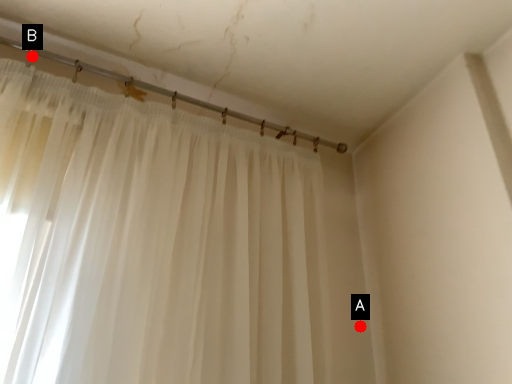
Question: Two points are circled on the image, labeled by A and B beside each circle. Among these points, which one is farthest from the camera?

Choices:
 (A) A is further
 (B) B is further

Answer: (A)